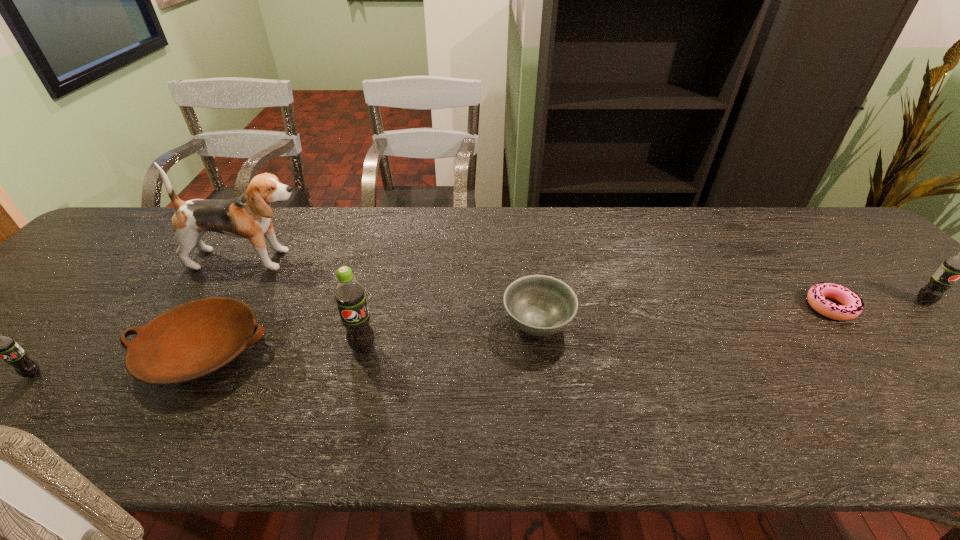
Locate an element on the screen. The image size is (960, 540). the fourth tallest object is located at coordinates (5, 347).

Image resolution: width=960 pixels, height=540 pixels. I want to click on the leftmost soda, so click(5, 347).

Identify the location of the second tallest object. (349, 294).

The height and width of the screenshot is (540, 960). In order to click on the tallest soda in this screenshot , I will do `click(349, 294)`.

This screenshot has width=960, height=540. Identify the location of the third tallest object. (959, 266).

Identify the location of the farthest soda. The height and width of the screenshot is (540, 960). (959, 266).

The image size is (960, 540). Identify the location of the farthest object. (248, 216).

Image resolution: width=960 pixels, height=540 pixels. What are the coordinates of `puppy` in the screenshot? It's located at (248, 216).

You are a GUI agent. You are given a task and a screenshot of the screen. Output one action in this format:
    pyautogui.click(x=<x>, y=<y>)
    Task: Click on the fifth object from left to right
    This screenshot has width=960, height=540.
    Given the screenshot: What is the action you would take?
    pyautogui.click(x=539, y=305)

The width and height of the screenshot is (960, 540). Find the location of `the fifth tallest object`. the fifth tallest object is located at coordinates (539, 305).